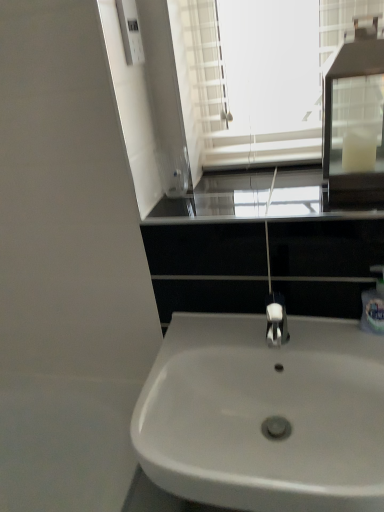
Question: Considering the positions of black glass window sill at center and white plastic soap dispenser at right in the image, is black glass window sill at center taller or shorter than white plastic soap dispenser at right?

Choices:
 (A) tall
 (B) short

Answer: (B)

Question: From the image's perspective, relative to white plastic soap dispenser at right, is black glass window sill at center above or below?

Choices:
 (A) above
 (B) below

Answer: (A)

Question: Considering the real-world distances, which object is farthest from the white glossy sink at center?

Choices:
 (A) black glass window sill at center
 (B) white glass medicine cabinet at upper right
 (C) white plastic soap dispenser at right

Answer: (B)

Question: Considering the real-world distances, which object is farthest from the white glossy sink at center?

Choices:
 (A) black glass window sill at center
 (B) white glass medicine cabinet at upper right
 (C) white plastic soap dispenser at right

Answer: (B)